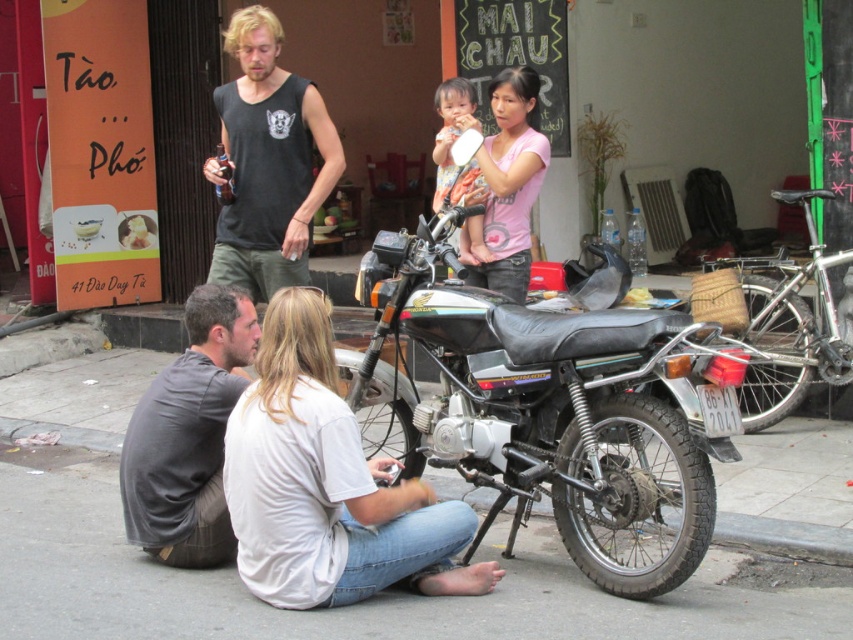
What are the coordinates of the black sleeveless shirt at upper center in the image?

The coordinates of the black sleeveless shirt at upper center are at point (270, 161).

You are a fashion designer observing the street scene. You notice the black sleeveless shirt at upper center and the gray cotton shirt at lower left. Which of these two shirts is positioned higher in the image?

The black sleeveless shirt at upper center is positioned higher in the image than the gray cotton shirt at lower left.